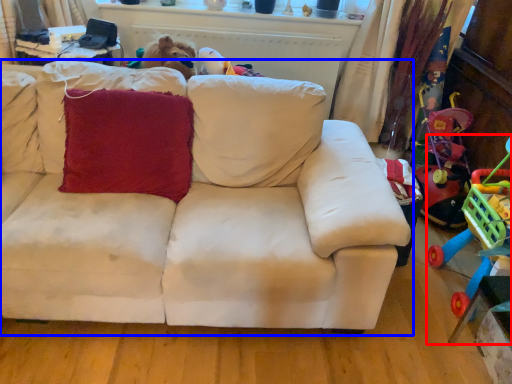
Question: Among these objects, which one is nearest to the camera, toy (highlighted by a red box) or studio couch (highlighted by a blue box)?

Choices:
 (A) toy
 (B) studio couch

Answer: (A)